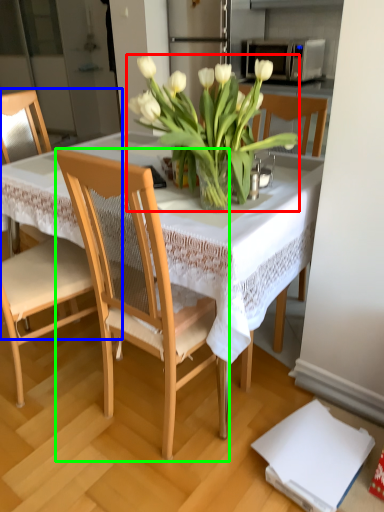
Question: Estimate the real-world distances between objects in this image. Which object is farther from flower (highlighted by a red box), chair (highlighted by a blue box) or chair (highlighted by a green box)?

Choices:
 (A) chair
 (B) chair

Answer: (A)